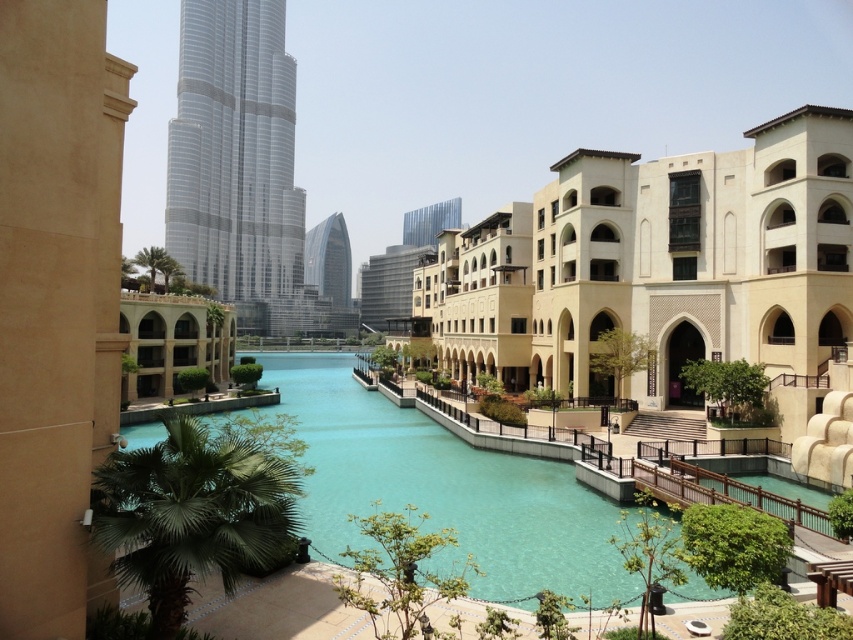
Looking at this image, does beige stone building at center have a smaller size compared to shiny glass tower at center?

Yes, beige stone building at center is smaller than shiny glass tower at center.

Which is above, beige stone building at center or shiny glass tower at center?

shiny glass tower at center is higher up.

Is point (415, 305) more distant than point (334, 308)?

No, it is in front of (334, 308).

Identify the location of beige stone building at center. The height and width of the screenshot is (640, 853). pyautogui.click(x=659, y=268).

Which of these two, beige stone building at center or turquoise glassy water at center, stands taller?

beige stone building at center

Who is more forward, (721,260) or (393,493)?

Point (393,493) is more forward.

Find the location of a particular element. Image resolution: width=853 pixels, height=640 pixels. beige stone building at center is located at coordinates (659, 268).

Is point (848, 336) closer to camera compared to point (624, 371)?

Yes, it is.

At what (x,y) coordinates should I click in order to perform the action: click on beige stone building at center. Please return your answer as a coordinate pair (x, y). This screenshot has width=853, height=640. Looking at the image, I should click on (659, 268).

You are a GUI agent. You are given a task and a screenshot of the screen. Output one action in this format:
    pyautogui.click(x=<x>, y=<y>)
    Task: Click on the beige stone building at center
    This screenshot has width=853, height=640.
    Given the screenshot: What is the action you would take?
    pyautogui.click(x=659, y=268)